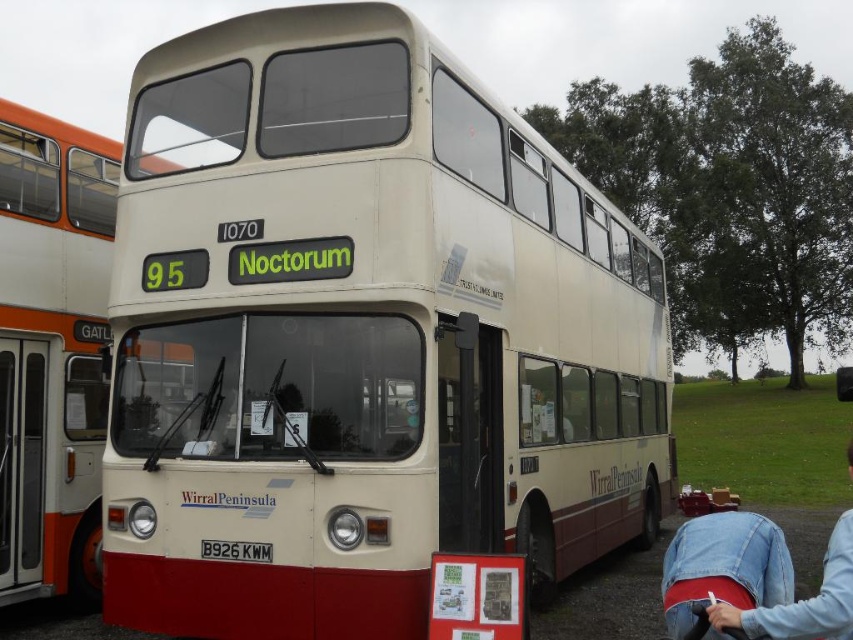
You are standing at the point marked by coordinates (51, 352). Based on the scene description, what object are you directly facing?

The point marked by coordinates (51, 352) indicates that you are directly facing the white glossy bus at center.

Based on the scene description, where exactly is the white glossy bus at center located in terms of coordinates?

The white glossy bus at center is located at coordinates point (51,352).

You are standing at the point with coordinates (51,352). Based on the scene described, what object are you directly at?

The point at coordinates (51,352) corresponds to the white glossy bus at center.